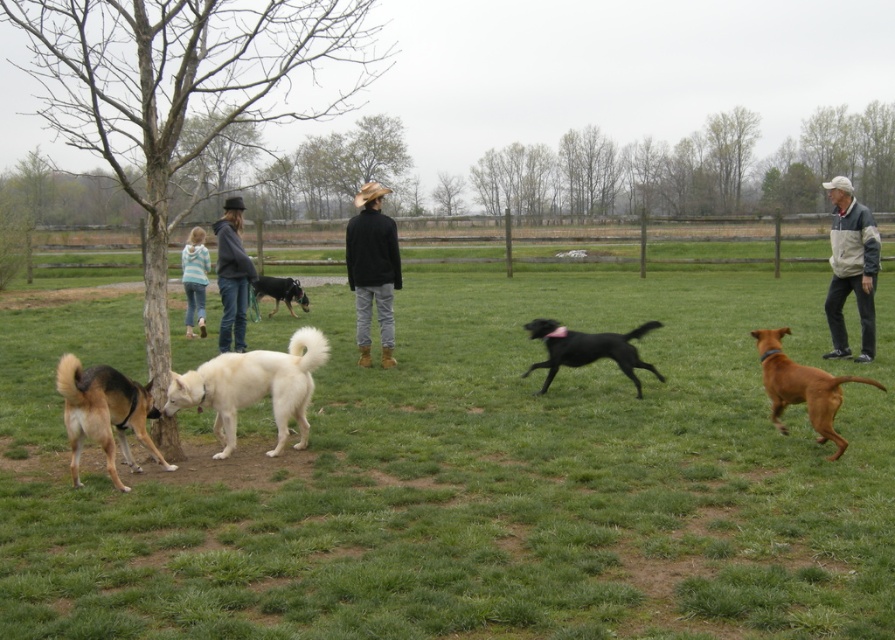
Question: Which object appears farthest from the camera in this image?

Choices:
 (A) shiny black dog at center
 (B) brown glossy dog at right
 (C) gray sweater at center

Answer: (C)

Question: Is shiny black dog at center below striped sweater at left?

Choices:
 (A) no
 (B) yes

Answer: (B)

Question: Is striped sweater at left smaller than black glossy dog at center?

Choices:
 (A) yes
 (B) no

Answer: (A)

Question: Which object is positioned farthest from the brown glossy dog at right?

Choices:
 (A) white fleece jacket at right
 (B) black glossy dog at center
 (C) striped sweater at left

Answer: (B)

Question: Is white fleece jacket at right to the left of gray sweater at center from the viewer's perspective?

Choices:
 (A) no
 (B) yes

Answer: (A)

Question: Which of these objects is positioned closest to the white fleece jacket at right?

Choices:
 (A) black glossy dog at center
 (B) green grass at center
 (C) brown fur dog at lower left

Answer: (B)